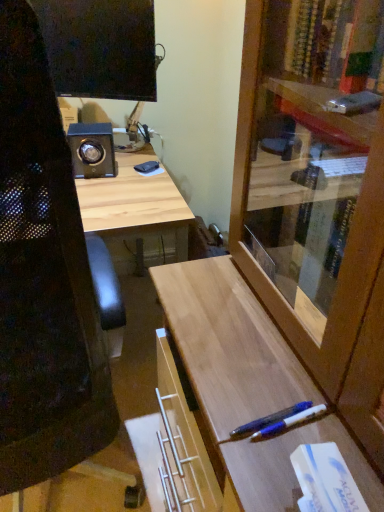
Question: Can you confirm if wooden cabinet at center-right is positioned to the left of black mesh computer chair at left?

Choices:
 (A) yes
 (B) no

Answer: (B)

Question: Is black mesh computer chair at left surrounded by wooden cabinet at center-right?

Choices:
 (A) no
 (B) yes

Answer: (A)

Question: Considering the relative sizes of wooden cabinet at center-right and black mesh computer chair at left in the image provided, is wooden cabinet at center-right smaller than black mesh computer chair at left?

Choices:
 (A) yes
 (B) no

Answer: (B)

Question: From a real-world perspective, does wooden cabinet at center-right sit lower than black mesh computer chair at left?

Choices:
 (A) no
 (B) yes

Answer: (A)

Question: Can you confirm if wooden cabinet at center-right is bigger than black mesh computer chair at left?

Choices:
 (A) yes
 (B) no

Answer: (A)

Question: Considering the relative sizes of wooden cabinet at center-right and black mesh computer chair at left in the image provided, is wooden cabinet at center-right taller than black mesh computer chair at left?

Choices:
 (A) yes
 (B) no

Answer: (B)

Question: Can you confirm if translucent blue pen at lower right is smaller than white matte book at lower right?

Choices:
 (A) no
 (B) yes

Answer: (B)

Question: Is translucent blue pen at lower right bigger than white matte book at lower right?

Choices:
 (A) no
 (B) yes

Answer: (A)

Question: From the image's perspective, is translucent blue pen at lower right under white matte book at lower right?

Choices:
 (A) yes
 (B) no

Answer: (B)

Question: Is translucent blue pen at lower right at the left side of white matte book at lower right?

Choices:
 (A) yes
 (B) no

Answer: (A)

Question: Is translucent blue pen at lower right completely or partially outside of white matte book at lower right?

Choices:
 (A) no
 (B) yes

Answer: (B)

Question: Is translucent blue pen at lower right beside white matte book at lower right?

Choices:
 (A) yes
 (B) no

Answer: (B)

Question: Is translucent blue pen at lower right at the right side of wooden cabinet at center-right?

Choices:
 (A) yes
 (B) no

Answer: (B)